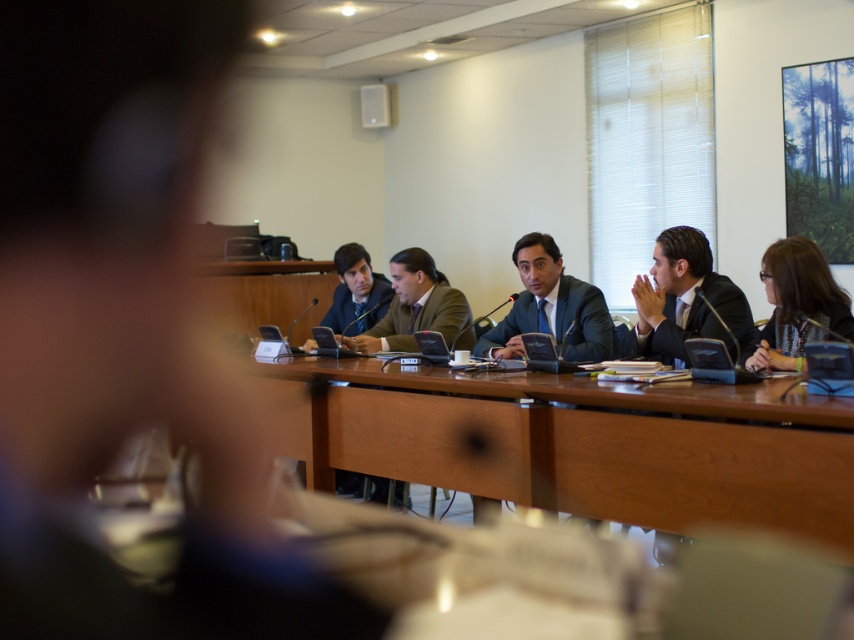
You are a photographer positioned at the back of the room. You want to take a photo of the patterned fabric jacket at lower right and the matte black suit at center. Which object should you focus on first to ensure both are in sharp focus?

The patterned fabric jacket at lower right is closer to the viewer than the matte black suit at center. To ensure both are in sharp focus, you should focus on the matte black suit at center first, as it is farther away, allowing the depth of field to cover both objects.

You are a photographer setting up for a group photo. You need to position yourself so that both the matte black suit at right and the patterned fabric jacket at lower right are in frame. Based on their positions, which object should you prioritize keeping centered to ensure both are visible?

You should prioritize keeping the matte black suit at right centered because it might be wider than the patterned fabric jacket at lower right, so ensuring it is centered will help both fit within the frame.